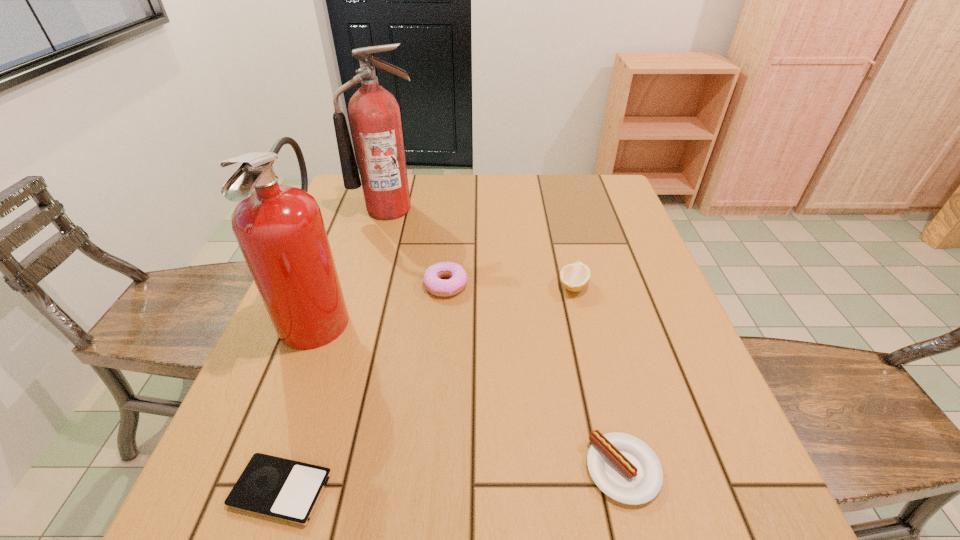
At what (x,y) coordinates should I click in order to perform the action: click on the farther fire extinguisher. Please return your answer as a coordinate pair (x, y). The height and width of the screenshot is (540, 960). Looking at the image, I should click on (374, 114).

Locate an element on the screen. The width and height of the screenshot is (960, 540). the nearer fire extinguisher is located at coordinates [x=280, y=230].

The image size is (960, 540). Identify the location of lemon. (574, 277).

Locate an element on the screen. Image resolution: width=960 pixels, height=540 pixels. the fourth object from left to right is located at coordinates (458, 277).

I want to click on sausage, so click(626, 469).

The height and width of the screenshot is (540, 960). I want to click on the shortest object, so click(x=287, y=490).

Locate an element on the screen. free space located on the front of the farthest object near the operation label is located at coordinates (378, 244).

You are a GUI agent. You are given a task and a screenshot of the screen. Output one action in this format:
    pyautogui.click(x=<x>, y=<y>)
    Task: Click on the blank space located with the handle and nozzle on the nearer fire extinguisher
    The height and width of the screenshot is (540, 960).
    Given the screenshot: What is the action you would take?
    pyautogui.click(x=488, y=312)

Identify the location of vacant position located on the left of the lemon. The image size is (960, 540). (427, 286).

At what (x,y) coordinates should I click in order to perform the action: click on vacant space located 0.100m on the front of the third object from right to left. Please return your answer as a coordinate pair (x, y). The height and width of the screenshot is (540, 960). Looking at the image, I should click on (442, 332).